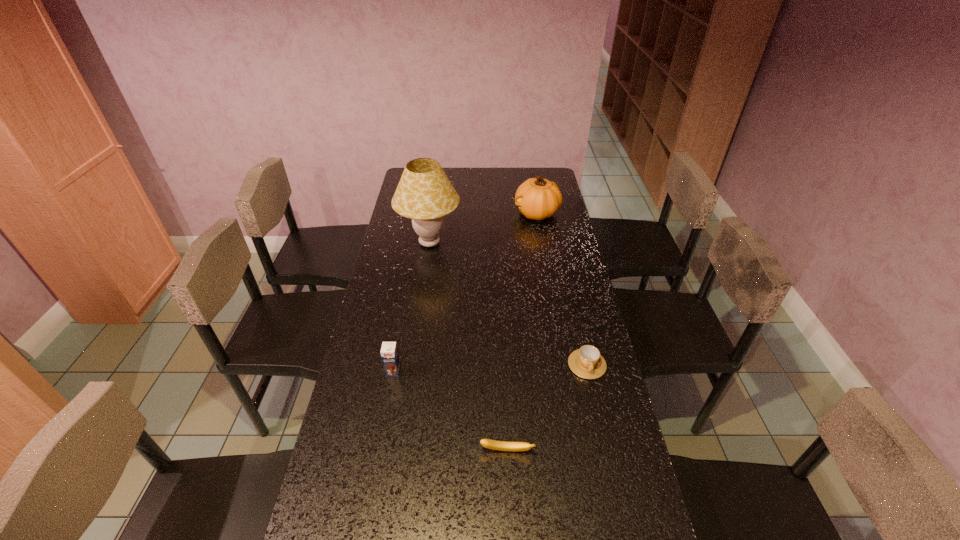
Identify which object is the second closest to the lampshade. Please provide its 2D coordinates. Your answer should be formatted as a tuple, i.e. [(x, y)], where the tuple contains the x and y coordinates of a point satisfying the conditions above.

[(389, 353)]

Find the location of a particular element. This screenshot has height=540, width=960. object that stands as the second closest to the nearest object is located at coordinates (389, 353).

Where is `free space that satisfies the following two spatial constraints: 1. on the front face of the pumpkin; 2. on the front label of the chocolate milk`? This screenshot has width=960, height=540. free space that satisfies the following two spatial constraints: 1. on the front face of the pumpkin; 2. on the front label of the chocolate milk is located at coordinates (564, 371).